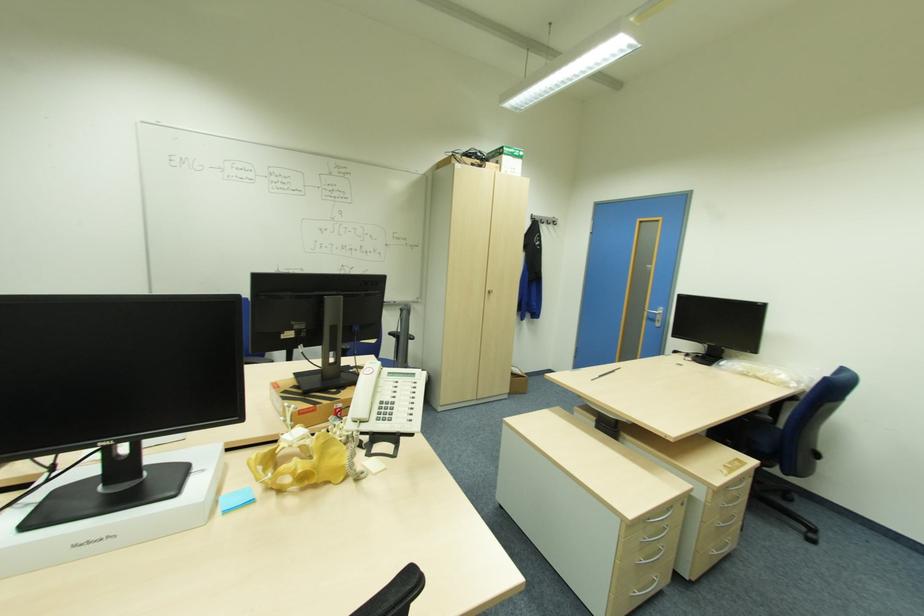
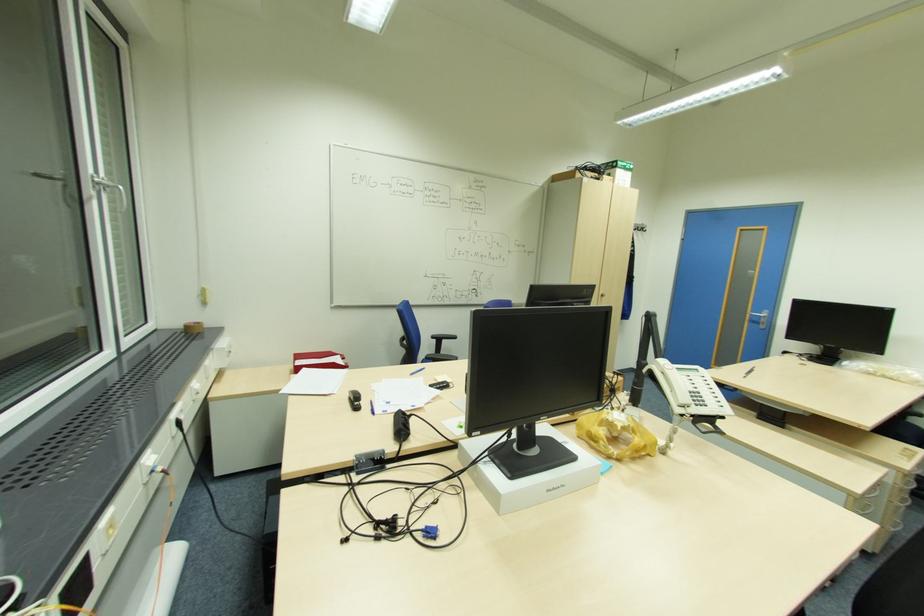
Find the pixel in the second image that matches (661,321) in the first image.

(766, 323)